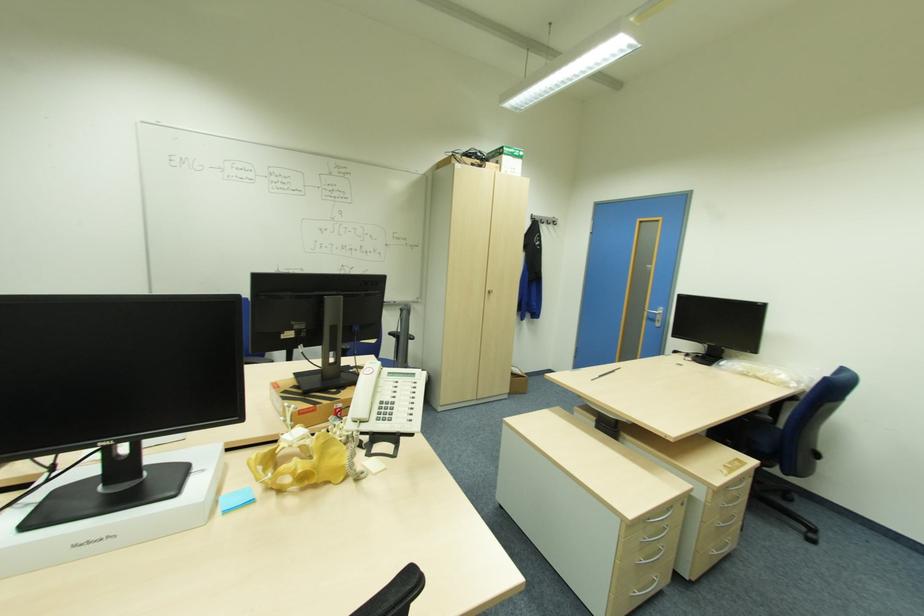
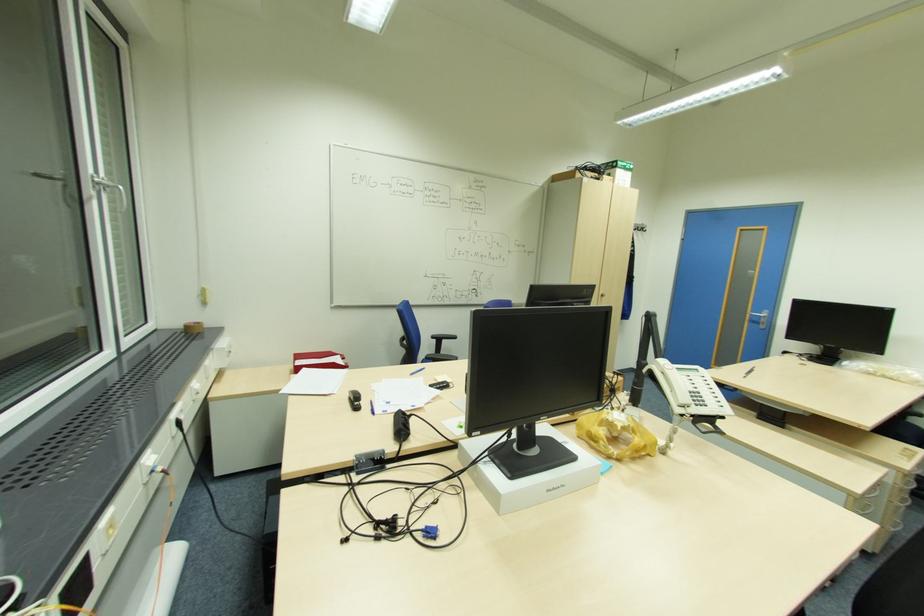
Find the pixel in the second image that matches (661,321) in the first image.

(766, 323)